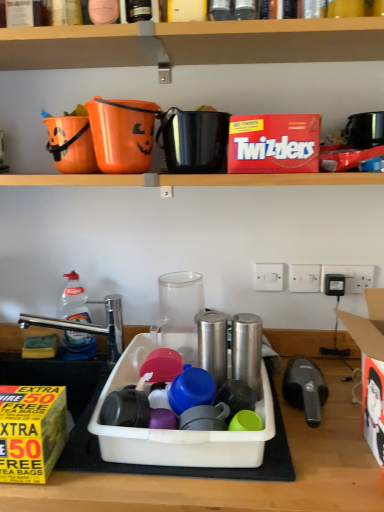
You are a GUI agent. You are given a task and a screenshot of the screen. Output one action in this format:
    pyautogui.click(x=<x>, y=<y>)
    Task: Click on the free space in front of red cardboard box at upper center, the first box in the right-to-left sequence
    The width and height of the screenshot is (384, 512).
    Given the screenshot: What is the action you would take?
    pyautogui.click(x=286, y=169)